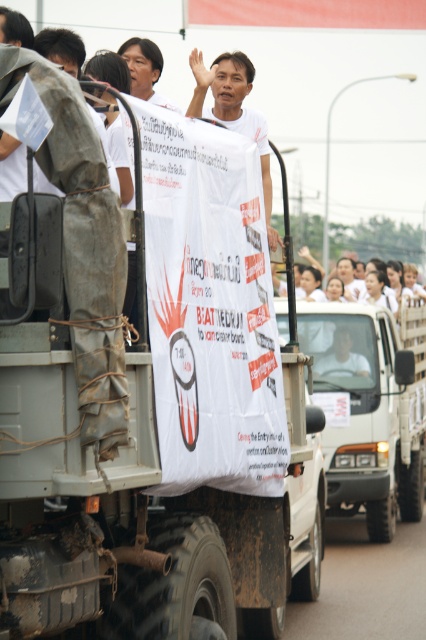
You are a photographer taking a picture of the protest scene. You notice two points in the image at coordinates point (371, 371) and point (189, 60). Which point is closer to the camera?

Point (189, 60) is closer to the camera because point (371, 371) is further away from the camera than point (189, 60).

You are a photographer trying to capture the protest scene. You notice the rusty metal suit at left and the white matte banner at center. Which object is positioned closer to your camera lens?

The rusty metal suit at left is closer to the viewer than the white matte banner at center, so it will appear closer to the camera lens.